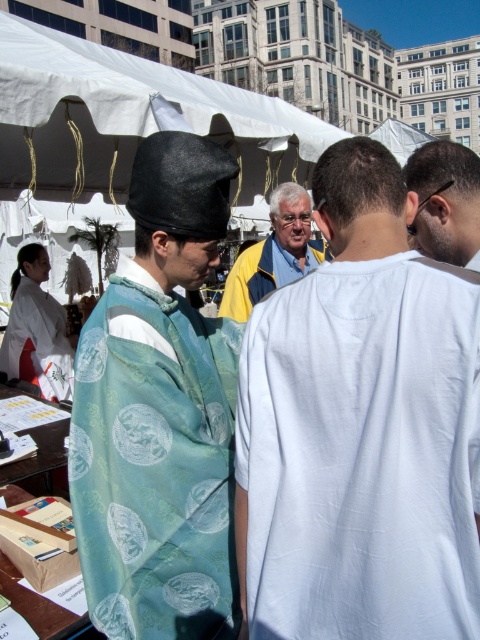
Question: Can you confirm if white cotton shirt at center is positioned to the right of silk kimono at center?

Choices:
 (A) yes
 (B) no

Answer: (A)

Question: Which object appears farthest from the camera in this image?

Choices:
 (A) blue fabric shirt at center
 (B) sunglasses at upper right

Answer: (A)

Question: Which of the following is the closest to the observer?

Choices:
 (A) silk kimono at center
 (B) light blue silk kimono at left
 (C) sunglasses at upper right

Answer: (A)

Question: Can you confirm if white cotton shirt at center is thinner than blue fabric shirt at center?

Choices:
 (A) no
 (B) yes

Answer: (B)

Question: Does blue fabric shirt at center appear on the left side of light blue silk kimono at left?

Choices:
 (A) yes
 (B) no

Answer: (B)

Question: Which is farther from the white cotton shirt at center?

Choices:
 (A) silk kimono at center
 (B) sunglasses at upper right

Answer: (B)